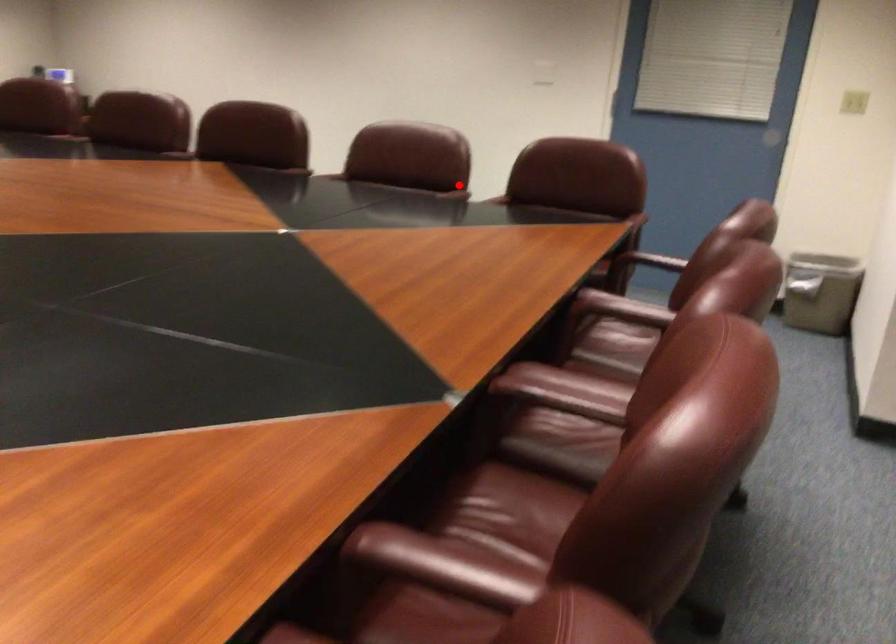
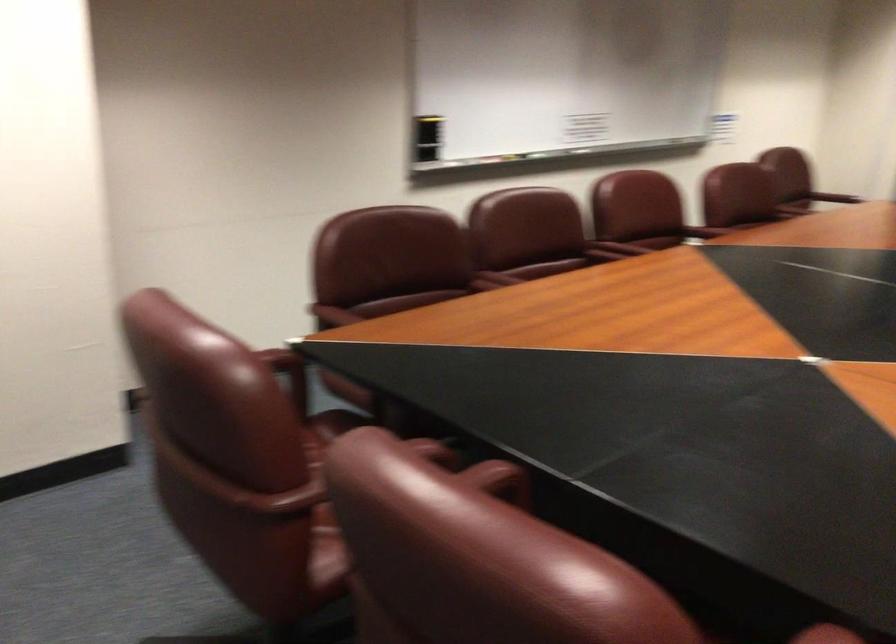
Question: I am providing you with two images of the same scene from different viewpoints. A red point is shown in image1. For the corresponding object point in image2, is it positioned nearer or farther from the camera?

Choices:
 (A) Nearer
 (B) Farther

Answer: (A)